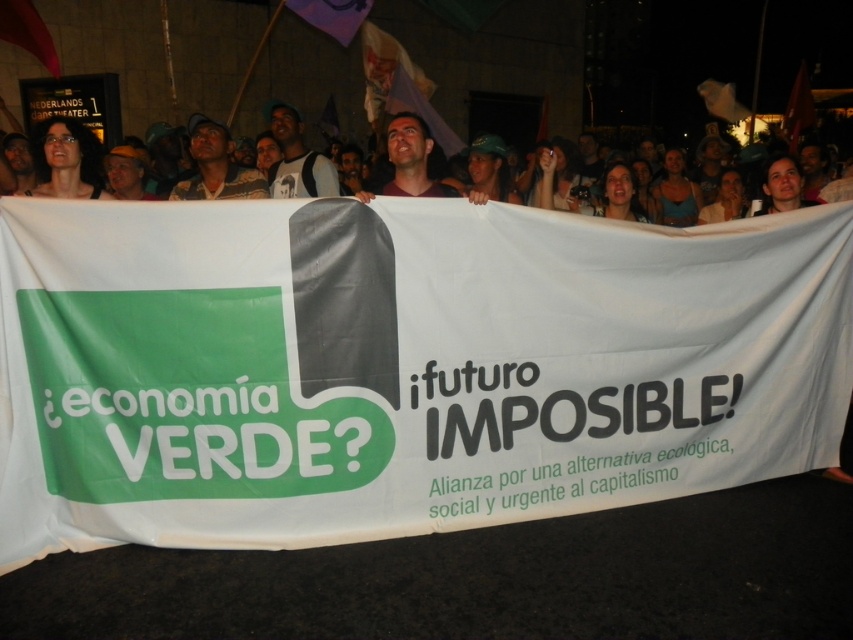
Between matte black hair at upper left and matte brown shirt at center, which one has less height?

Standing shorter between the two is matte black hair at upper left.

Does matte black hair at upper left have a lesser height compared to matte brown shirt at center?

Correct, matte black hair at upper left is not as tall as matte brown shirt at center.

Where is `matte black hair at upper left`? This screenshot has width=853, height=640. matte black hair at upper left is located at coordinates point(67,161).

Looking at this image, which is above, matte black backpack at upper center or matte brown shirt at center?

Positioned higher is matte black backpack at upper center.

Does point (280, 112) come farther from viewer compared to point (432, 189)?

Yes, point (280, 112) is farther from viewer.

What do you see at coordinates (297, 161) in the screenshot? The height and width of the screenshot is (640, 853). I see `matte black backpack at upper center` at bounding box center [297, 161].

Locate an element on the screen. Image resolution: width=853 pixels, height=640 pixels. matte black backpack at upper center is located at coordinates (297, 161).

How far apart are matte black hair at upper left and matte black backpack at upper center?

matte black hair at upper left and matte black backpack at upper center are 1.26 meters apart.

Where is `matte black hair at upper left`? The width and height of the screenshot is (853, 640). matte black hair at upper left is located at coordinates (67, 161).